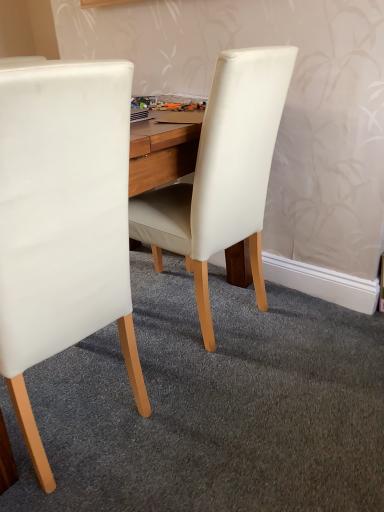
Question: From their relative heights in the image, would you say white leather chair at left, the 2th chair when ordered from right to left, is taller or shorter than white leather chair at center, which ranks as the 2th chair in left-to-right order?

Choices:
 (A) tall
 (B) short

Answer: (A)

Question: Would you say white leather chair at left, marked as the 1th chair in a left-to-right arrangement, is to the left or to the right of white leather chair at center, which ranks as the 2th chair in left-to-right order, in the picture?

Choices:
 (A) right
 (B) left

Answer: (B)

Question: Looking at their shapes, would you say white leather chair at left, marked as the 1th chair in a left-to-right arrangement, is wider or thinner than white leather chair at center, the 1th chair viewed from the right?

Choices:
 (A) wide
 (B) thin

Answer: (B)

Question: Looking at the image, does white leather chair at center, which ranks as the 2th chair in left-to-right order, seem bigger or smaller compared to white leather chair at left, the 2th chair when ordered from right to left?

Choices:
 (A) big
 (B) small

Answer: (B)

Question: From a real-world perspective, relative to white leather chair at left, the 2th chair when ordered from right to left, is white leather chair at center, which ranks as the 2th chair in left-to-right order, vertically above or below?

Choices:
 (A) below
 (B) above

Answer: (A)

Question: In terms of height, does white leather chair at center, which ranks as the 2th chair in left-to-right order, look taller or shorter compared to white leather chair at left, marked as the 1th chair in a left-to-right arrangement?

Choices:
 (A) tall
 (B) short

Answer: (B)

Question: In the image, is white leather chair at center, the 1th chair viewed from the right, positioned in front of or behind white leather chair at left, marked as the 1th chair in a left-to-right arrangement?

Choices:
 (A) behind
 (B) front

Answer: (A)